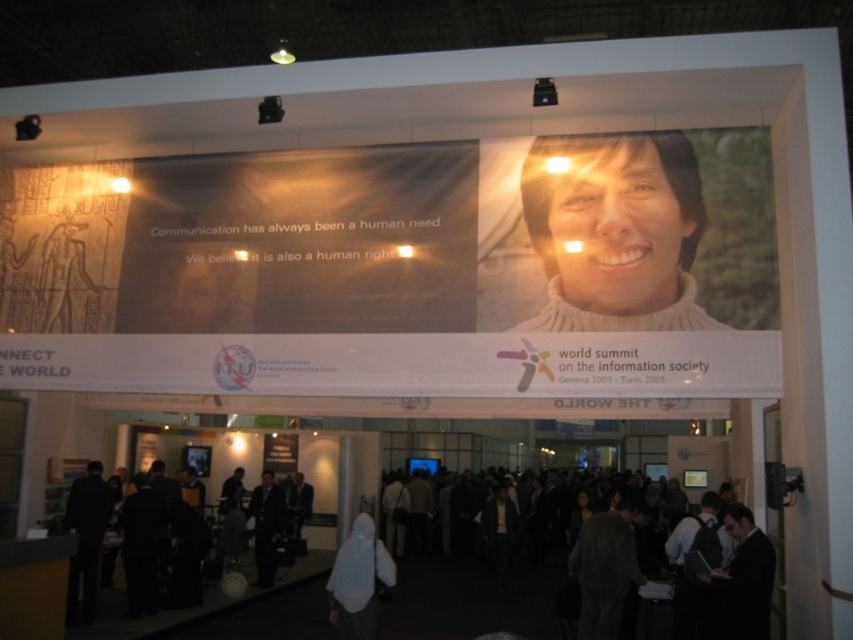
This screenshot has height=640, width=853. What do you see at coordinates (399, 269) in the screenshot?
I see `matte white banner at upper center` at bounding box center [399, 269].

Identify the location of matte white banner at upper center. The image size is (853, 640). (399, 269).

Does matte white banner at upper center appear under dark suit at center?

No, matte white banner at upper center is not below dark suit at center.

Does point (415, 209) come farther from viewer compared to point (270, 493)?

No.

Between point (601, 282) and point (254, 506), which one is positioned behind?

The point (254, 506) is behind.

Identify the location of matte white banner at upper center. (399, 269).

Which of these two, dark gray suit at center or white fabric at lower center, stands shorter?

white fabric at lower center is shorter.

In the scene shown: Which is more to the right, dark gray suit at center or white fabric at lower center?

dark gray suit at center

You are a GUI agent. You are given a task and a screenshot of the screen. Output one action in this format:
    pyautogui.click(x=<x>, y=<y>)
    Task: Click on the dark gray suit at center
    This screenshot has width=853, height=640.
    Given the screenshot: What is the action you would take?
    [x=605, y=566]

This screenshot has width=853, height=640. I want to click on dark gray suit at center, so click(x=605, y=566).